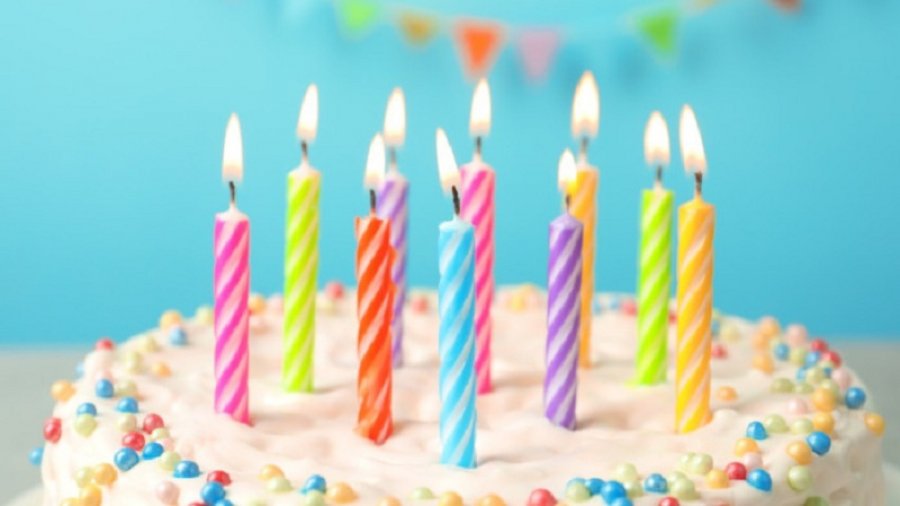
Locate an element on the screen. multicolored triangular pennants is located at coordinates (297, 2), (361, 12), (415, 26), (484, 39), (540, 49), (596, 42), (655, 26), (706, 4), (786, 4).